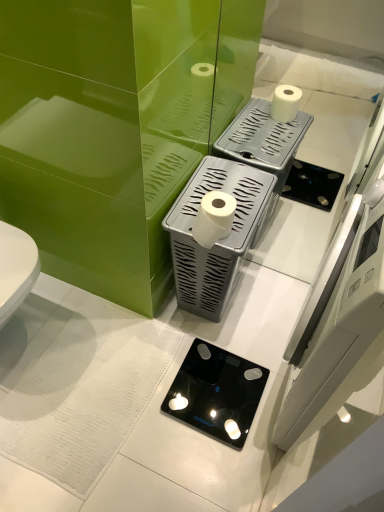
This screenshot has height=512, width=384. What are the coordinates of `vacant area that is situated to the right of white plastic toilet paper holder at center, the first appliance viewed from the top` in the screenshot? It's located at (273, 300).